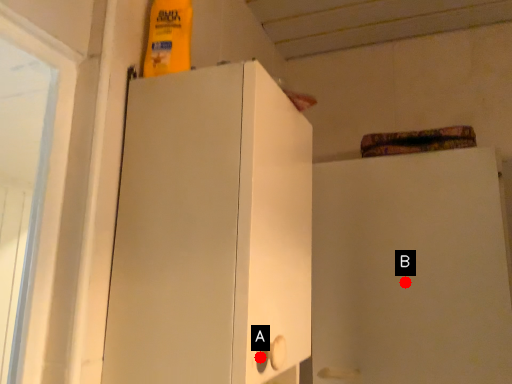
Question: Two points are circled on the image, labeled by A and B beside each circle. Which point appears farthest from the camera in this image?

Choices:
 (A) A is further
 (B) B is further

Answer: (B)